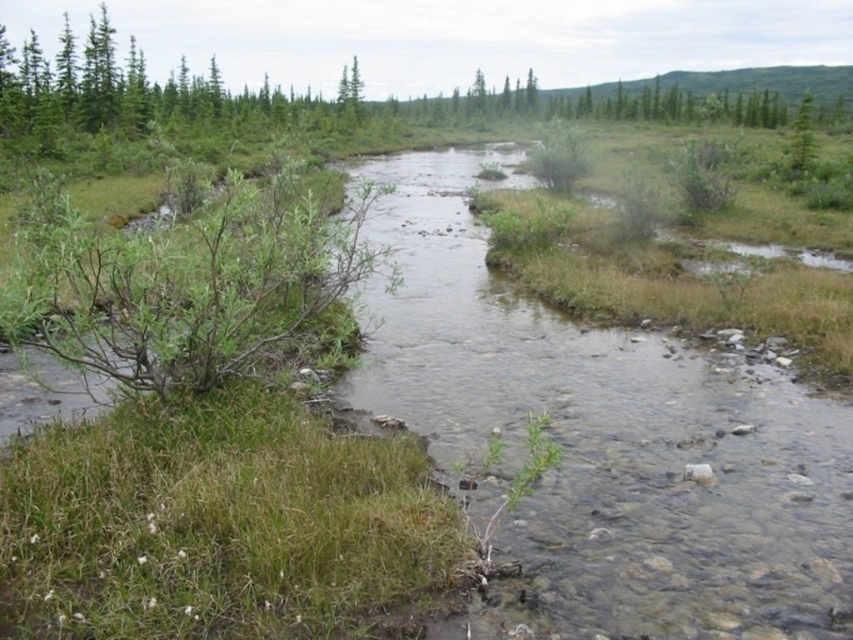
Who is higher up, clear water at center or green leafy tree at upper right?

green leafy tree at upper right is higher up.

Which is behind, point (670, 476) or point (804, 106)?

Point (804, 106)

At what (x,y) coordinates should I click in order to perform the action: click on clear water at center. Please return your answer as a coordinate pair (x, y). The height and width of the screenshot is (640, 853). Looking at the image, I should click on pos(607,438).